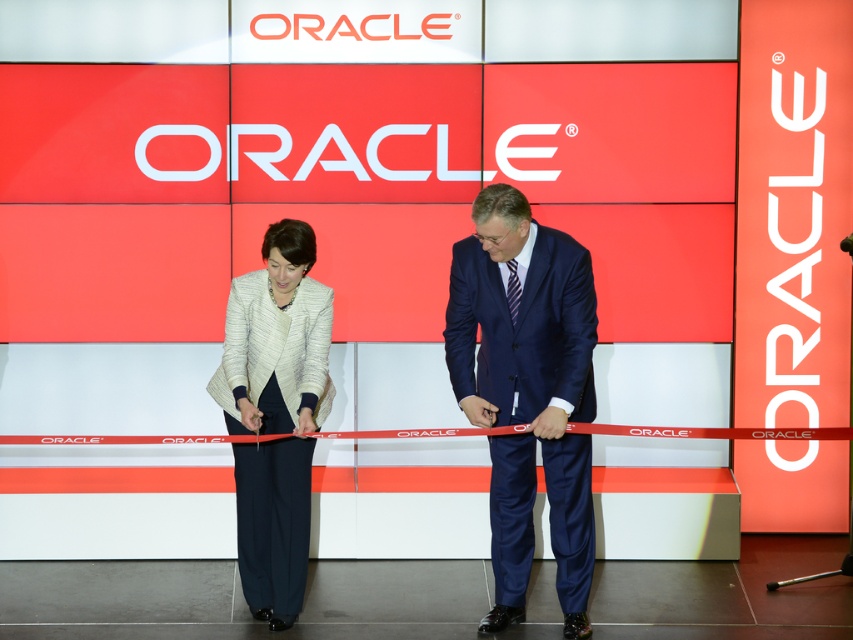
Who is positioned more to the left, navy blue suit at center or white textured blazer at center?

From the viewer's perspective, white textured blazer at center appears more on the left side.

Where is `navy blue suit at center`? The height and width of the screenshot is (640, 853). navy blue suit at center is located at coordinates (527, 392).

Which is in front, point (521, 291) or point (219, 401)?

Point (521, 291) is in front.

Locate an element on the screen. navy blue suit at center is located at coordinates (x=527, y=392).